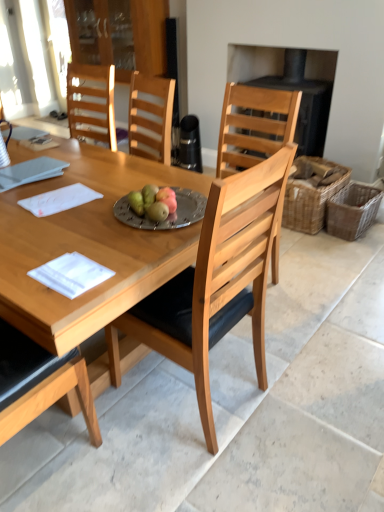
In order to click on vacant point above wooden table at center (from a real-world perspective) in this screenshot , I will do `click(64, 186)`.